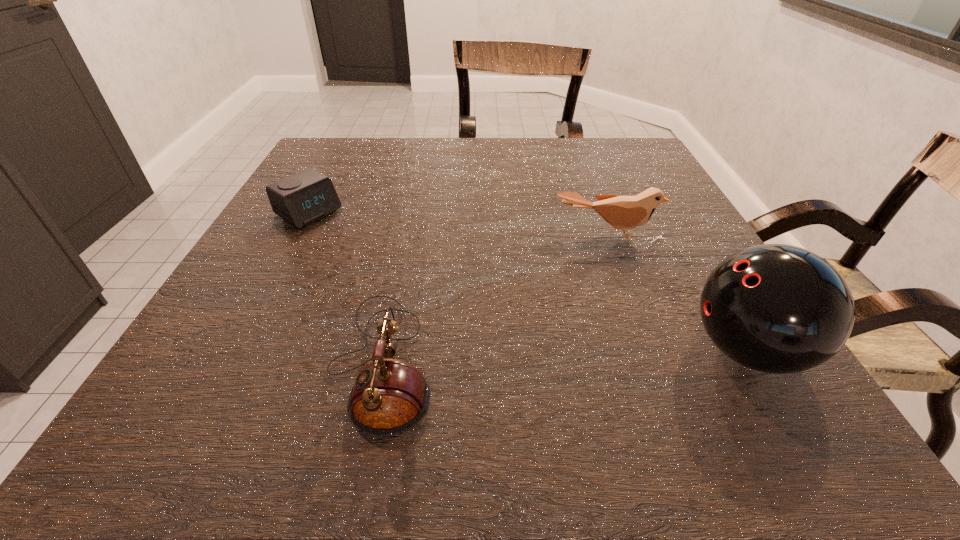
The width and height of the screenshot is (960, 540). What are the coordinates of `the second object from left to right` in the screenshot? It's located at [390, 396].

The image size is (960, 540). Find the location of `bowling ball`. bowling ball is located at coordinates (775, 308).

You are a GUI agent. You are given a task and a screenshot of the screen. Output one action in this format:
    pyautogui.click(x=<x>, y=<y>)
    Task: Click on the shortest object
    This screenshot has height=540, width=960.
    Given the screenshot: What is the action you would take?
    pyautogui.click(x=305, y=197)

The height and width of the screenshot is (540, 960). I want to click on the leftmost object, so click(x=305, y=197).

Find the location of `bird`. bird is located at coordinates (622, 212).

Locate an element on the screen. This screenshot has height=540, width=960. free space located on the rotary dial of the telephone is located at coordinates (217, 361).

Locate an element on the screen. vacant space located 0.070m on the rotary dial of the telephone is located at coordinates (284, 361).

Where is `free location located 0.050m on the rotary dial of the telephone`? The image size is (960, 540). free location located 0.050m on the rotary dial of the telephone is located at coordinates (298, 361).

In order to click on free space located on the surface of the tallest object near the finger holes in this screenshot , I will do `click(543, 350)`.

In order to click on free point located 0.180m on the surface of the tallest object near the finger holes in this screenshot , I will do `click(570, 350)`.